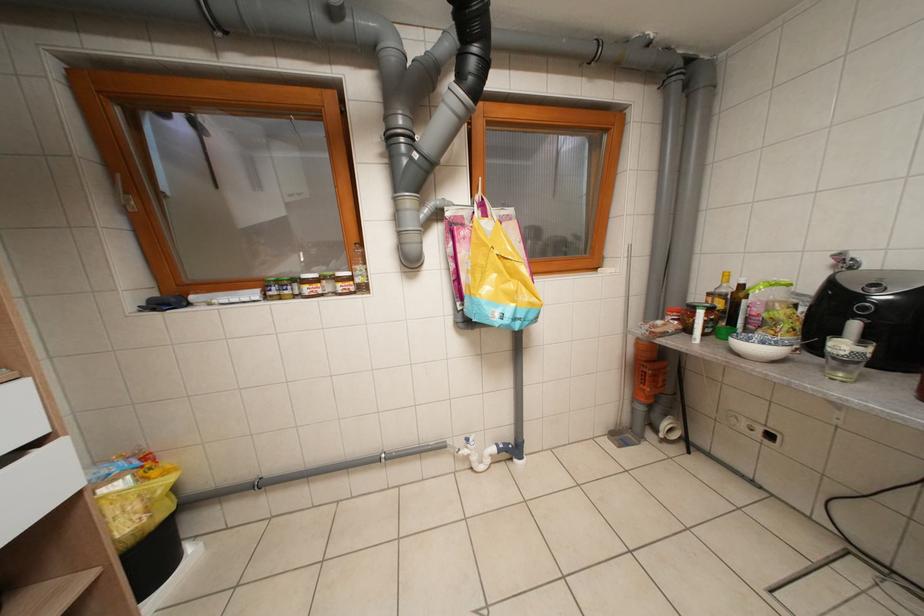
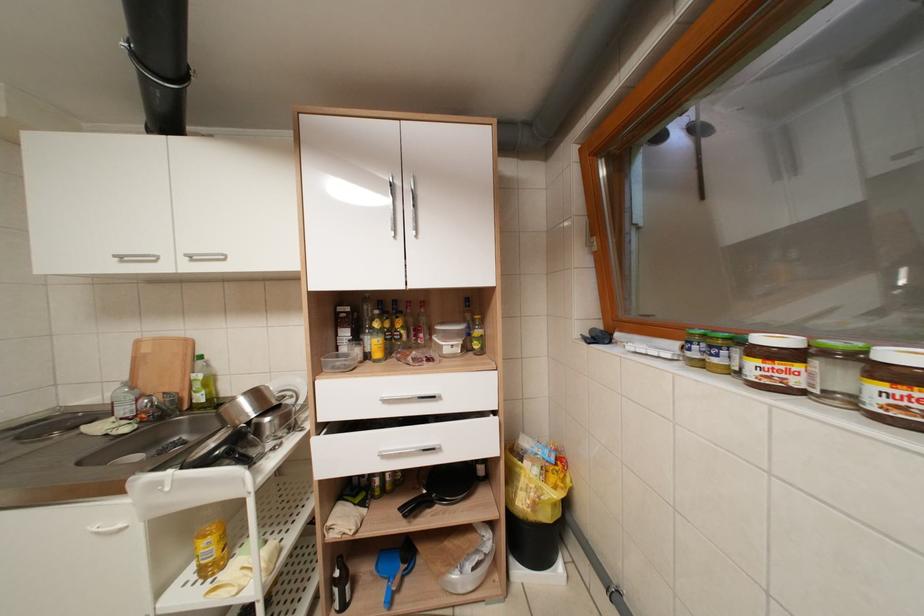
Question: The images are taken continuously from a first-person perspective. In which direction is your viewpoint rotating?

Choices:
 (A) Left
 (B) Right
 (C) Up
 (D) Down

Answer: (A)